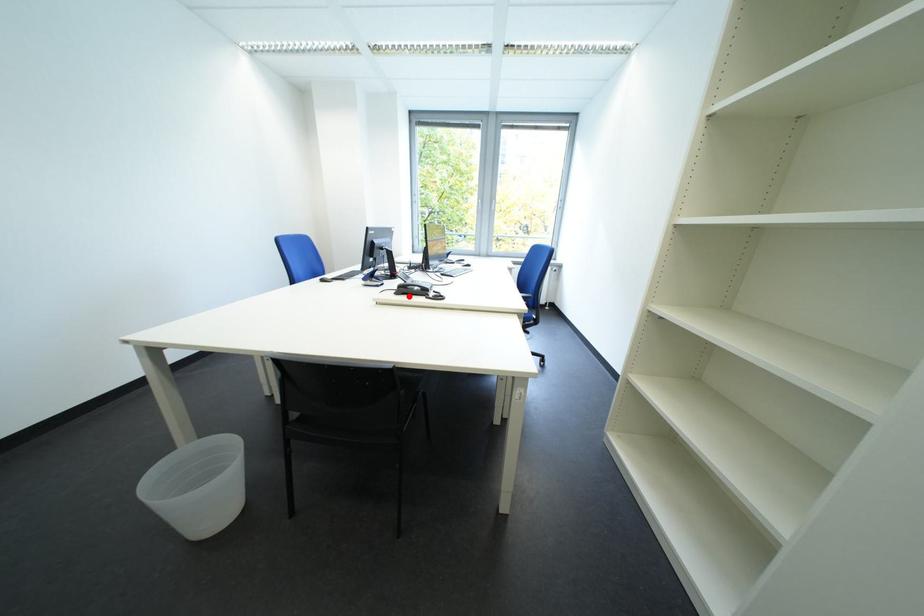
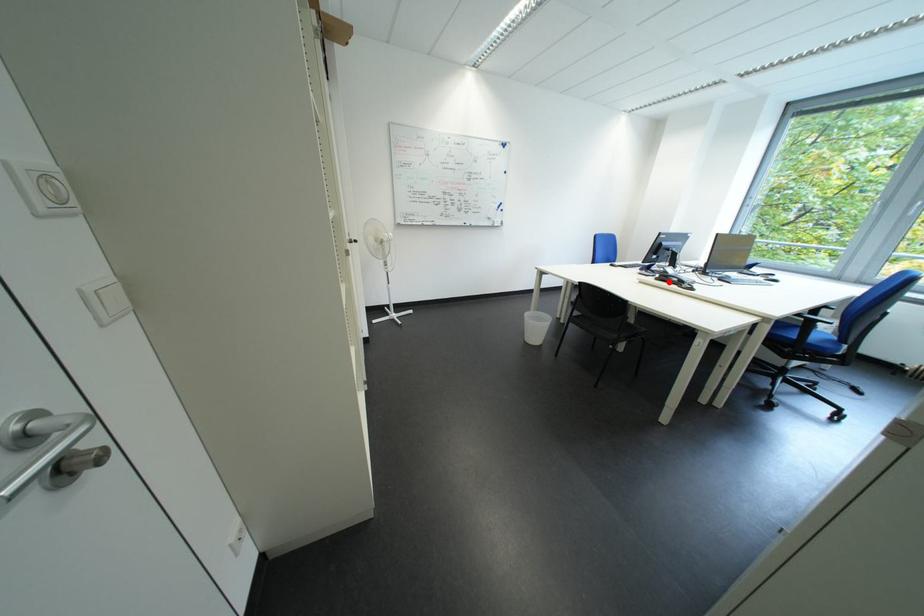
I am providing you with two images of the same scene from different viewpoints. A red point is marked on the first image and another point is marked on the second image. Does the point marked in image1 correspond to the same location as the one in image2?

Yes